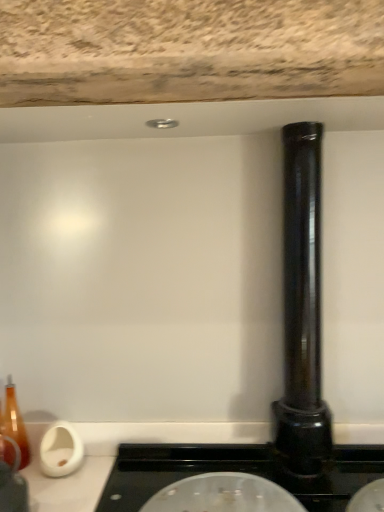
What are the coordinates of `black glossy pipe at right` in the screenshot? It's located at (302, 309).

This screenshot has width=384, height=512. What do you see at coordinates (302, 309) in the screenshot?
I see `black glossy pipe at right` at bounding box center [302, 309].

Image resolution: width=384 pixels, height=512 pixels. What do you see at coordinates (223, 495) in the screenshot?
I see `transparent glass lid at center` at bounding box center [223, 495].

The image size is (384, 512). I want to click on transparent glass lid at center, so click(x=223, y=495).

Locate an element on the screen. This screenshot has width=384, height=512. black glossy pipe at right is located at coordinates (302, 309).

Considering the positions of objects transparent glass lid at center and black glossy pipe at right in the image provided, who is more to the left, transparent glass lid at center or black glossy pipe at right?

From the viewer's perspective, transparent glass lid at center appears more on the left side.

Considering their positions, is transparent glass lid at center located in front of or behind black glossy pipe at right?

Clearly, transparent glass lid at center is in front of black glossy pipe at right.

Considering the positions of point (189, 490) and point (303, 421), is point (189, 490) closer or farther from the camera than point (303, 421)?

Point (189, 490) appears to be closer to the viewer than point (303, 421).

From the image's perspective, is transparent glass lid at center above or below black glossy pipe at right?

From the image's perspective, transparent glass lid at center appears below black glossy pipe at right.

From a real-world perspective, between transparent glass lid at center and black glossy pipe at right, who is vertically higher?

black glossy pipe at right, from a real-world perspective.

Looking at their sizes, would you say transparent glass lid at center is wider or thinner than black glossy pipe at right?

transparent glass lid at center is wider than black glossy pipe at right.

Considering the relative sizes of transparent glass lid at center and black glossy pipe at right in the image provided, is transparent glass lid at center taller than black glossy pipe at right?

No, transparent glass lid at center is not taller than black glossy pipe at right.

Who is bigger, transparent glass lid at center or black glossy pipe at right?

With larger size is black glossy pipe at right.

Is transparent glass lid at center inside or outside of black glossy pipe at right?

transparent glass lid at center lies outside black glossy pipe at right.

Is transparent glass lid at center in contact with black glossy pipe at right?

No, transparent glass lid at center is not in contact with black glossy pipe at right.

Could you tell me if transparent glass lid at center is facing black glossy pipe at right?

No.

What's the angular difference between transparent glass lid at center and black glossy pipe at right's facing directions?

They differ by 0.834 degrees in their facing directions.

Consider the image. Measure the distance between transparent glass lid at center and black glossy pipe at right.

14.34 inches.

Find the location of a particular element. This screenshot has width=384, height=512. pillar on the right of transparent glass lid at center is located at coordinates (302, 309).

Can you confirm if black glossy pipe at right is positioned to the left of transparent glass lid at center?

Incorrect, black glossy pipe at right is not on the left side of transparent glass lid at center.

Does black glossy pipe at right lie in front of transparent glass lid at center?

No, black glossy pipe at right is further to the viewer.

Considering the positions of points (291, 177) and (195, 485), is point (291, 177) farther from camera compared to point (195, 485)?

Yes, it is.

From the image's perspective, which one is positioned higher, black glossy pipe at right or transparent glass lid at center?

black glossy pipe at right, from the image's perspective.

From a real-world perspective, is black glossy pipe at right above or below transparent glass lid at center?

black glossy pipe at right is situated higher than transparent glass lid at center in the real world.

Which of these two, black glossy pipe at right or transparent glass lid at center, is wider?

transparent glass lid at center is wider.

Can you confirm if black glossy pipe at right is shorter than transparent glass lid at center?

In fact, black glossy pipe at right may be taller than transparent glass lid at center.

Looking at this image, who is bigger, black glossy pipe at right or transparent glass lid at center?

With larger size is black glossy pipe at right.

Is transparent glass lid at center inside black glossy pipe at right?

No, transparent glass lid at center is not inside black glossy pipe at right.

Is the surface of black glossy pipe at right in direct contact with transparent glass lid at center?

No, black glossy pipe at right is not next to transparent glass lid at center.

Based on the photo, is transparent glass lid at center at the back of black glossy pipe at right?

No, transparent glass lid at center is not at the back of black glossy pipe at right.

Measure the distance from black glossy pipe at right to transparent glass lid at center.

black glossy pipe at right is 14.34 inches from transparent glass lid at center.

The width and height of the screenshot is (384, 512). What are the coordinates of `appliance below the black glossy pipe at right (from the image's perspective)` in the screenshot? It's located at (223, 495).

Image resolution: width=384 pixels, height=512 pixels. What are the coordinates of `pillar on the right of the transparent glass lid at center` in the screenshot? It's located at (x=302, y=309).

Where is `pillar above the transparent glass lid at center (from the image's perspective)`? The image size is (384, 512). pillar above the transparent glass lid at center (from the image's perspective) is located at coordinates (302, 309).